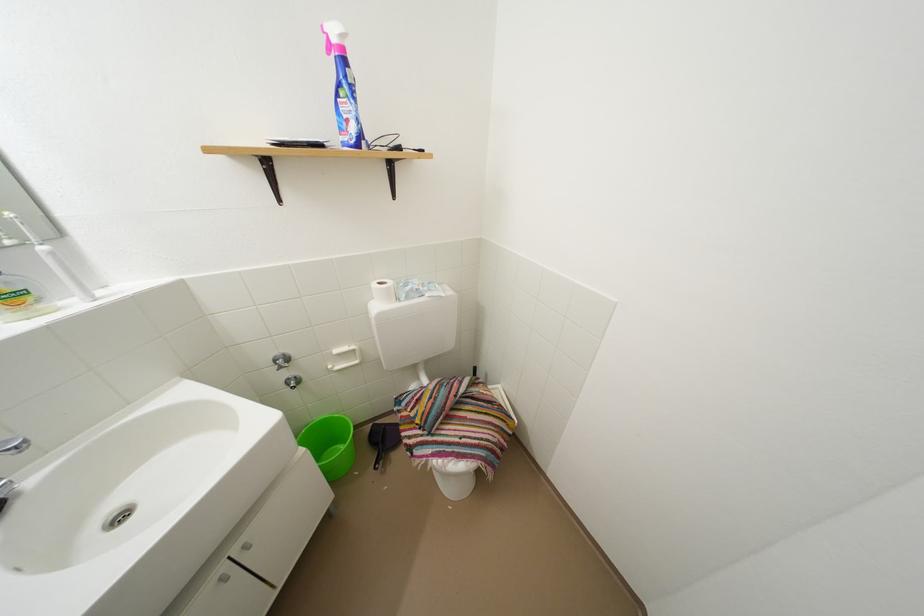
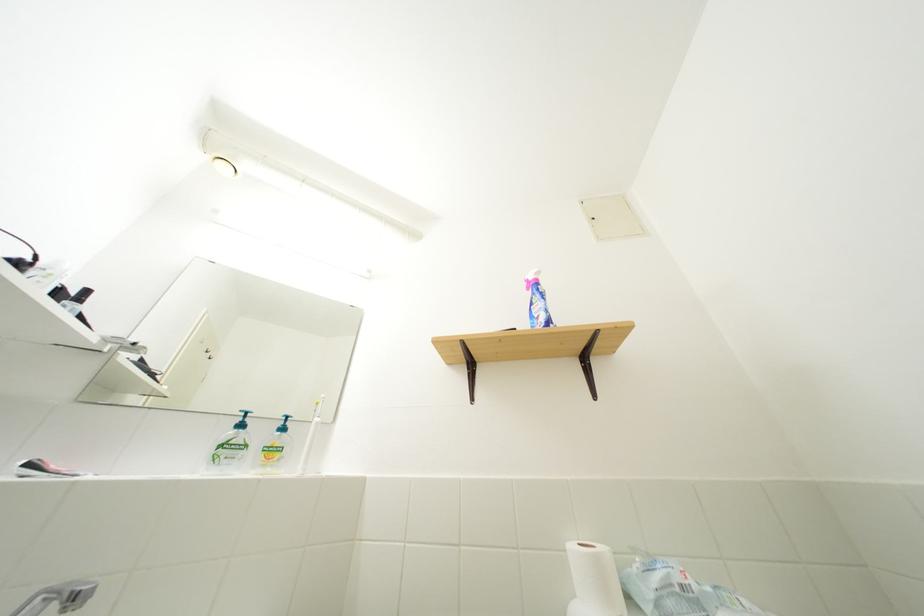
The point at (417, 294) is marked in the first image. Where is the corresponding point in the second image?

(665, 585)